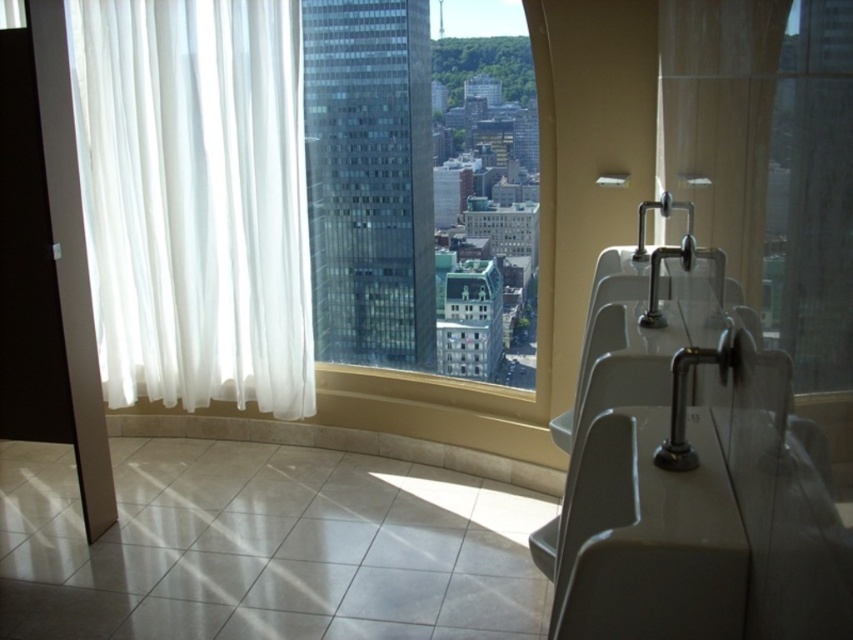
Question: Which point is closer to the camera?

Choices:
 (A) transparent glass window at center
 (B) gray matte sink at right

Answer: (B)

Question: Is transparent glass window at center smaller than gray matte sink at right?

Choices:
 (A) yes
 (B) no

Answer: (B)

Question: Is white sheer curtain at left to the left of gray matte sink at right from the viewer's perspective?

Choices:
 (A) no
 (B) yes

Answer: (B)

Question: Which object appears closest to the camera in this image?

Choices:
 (A) gray matte sink at right
 (B) white sheer curtain at left
 (C) transparent glass window at center

Answer: (A)

Question: Which of the following is the farthest from the observer?

Choices:
 (A) gray matte sink at right
 (B) transparent glass window at center
 (C) white sheer curtain at left

Answer: (C)

Question: Is white sheer curtain at left to the left of transparent glass window at center from the viewer's perspective?

Choices:
 (A) no
 (B) yes

Answer: (B)